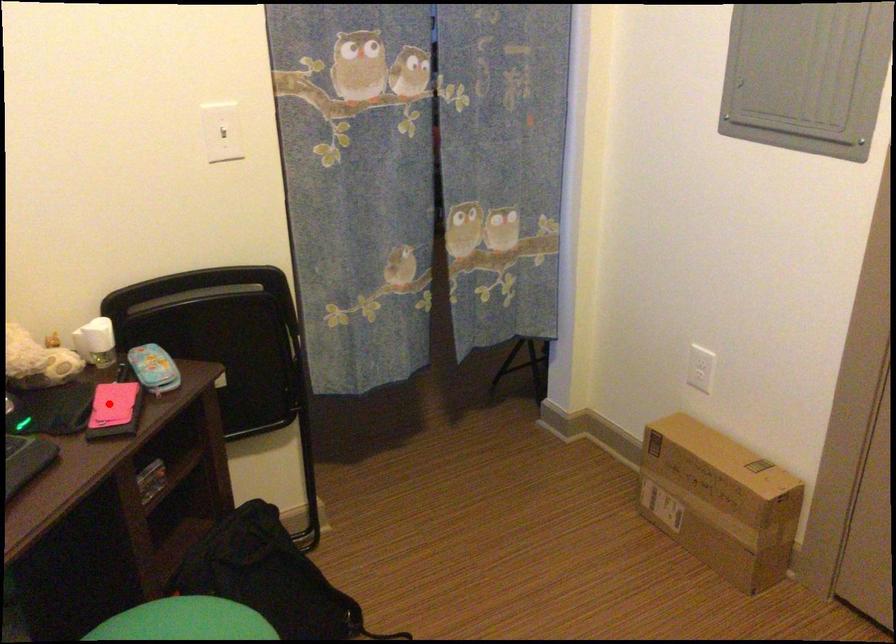
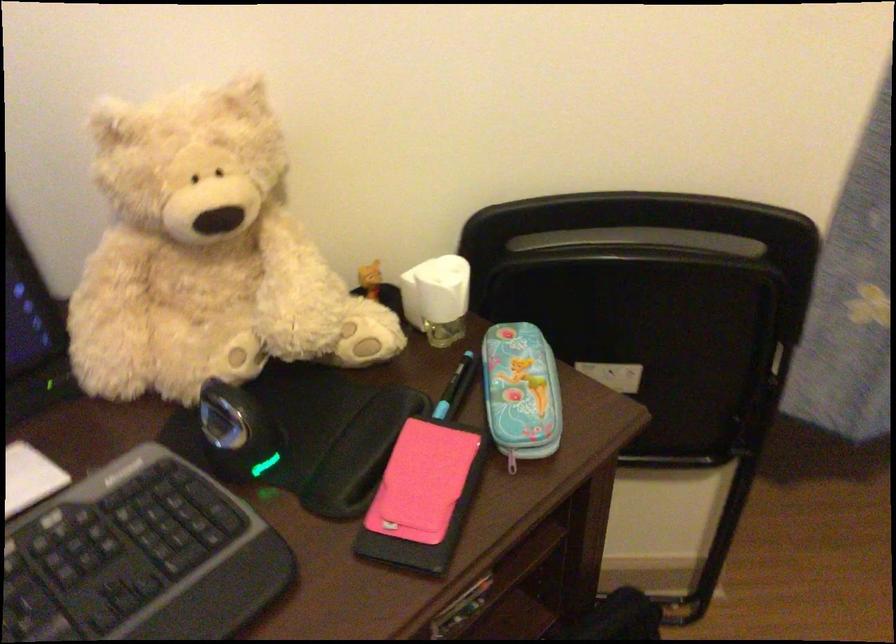
Question: I am providing you with two images of the same scene from different viewpoints. A red point is marked on the first image. Can you still see the location of the red point in image 2?

Choices:
 (A) Yes
 (B) No

Answer: (A)